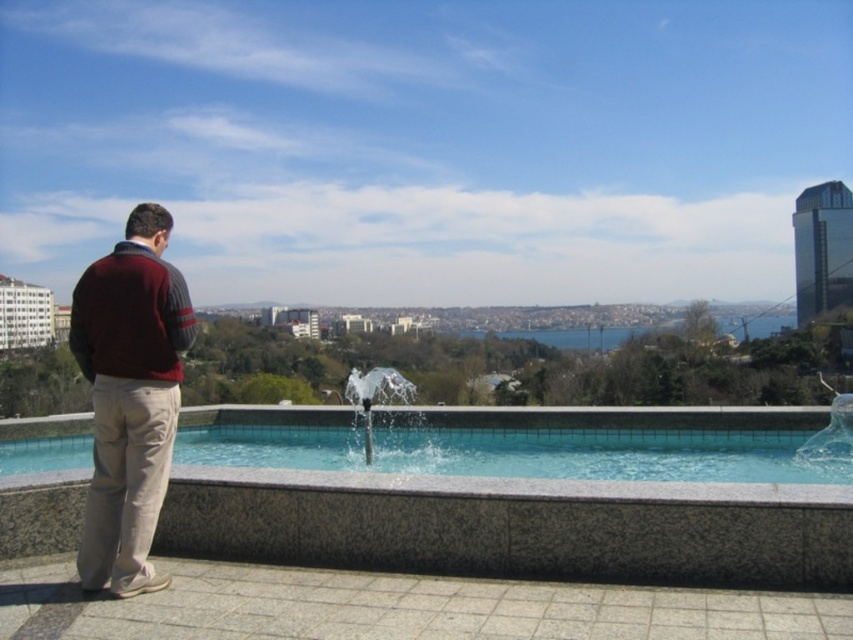
Question: Which point is farther to the camera?

Choices:
 (A) maroon sweater at left
 (B) clear glass water at center

Answer: (B)

Question: Is maroon sweater at left smaller than clear glass water at center?

Choices:
 (A) no
 (B) yes

Answer: (B)

Question: Which of the following is the farthest from the observer?

Choices:
 (A) clear glass water at center
 (B) maroon sweater at left

Answer: (A)

Question: Among these points, which one is farthest from the camera?

Choices:
 (A) (354, 404)
 (B) (123, 461)

Answer: (A)

Question: From the image, what is the correct spatial relationship of maroon sweater at left in relation to clear glass water at center?

Choices:
 (A) above
 (B) below

Answer: (A)

Question: Does maroon sweater at left lie behind clear glass water at center?

Choices:
 (A) no
 (B) yes

Answer: (A)